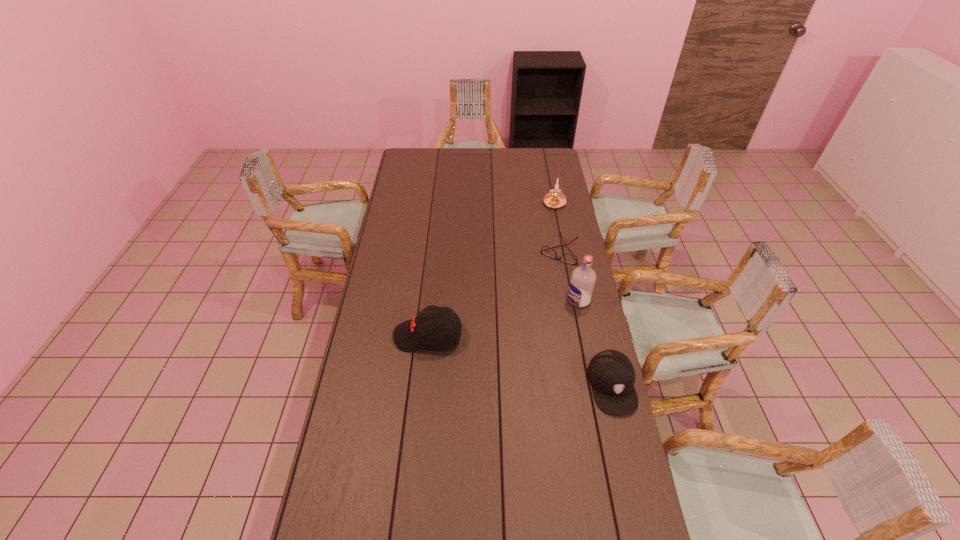
Identify the location of vacant spot on the desktop that is between the fourth farthest object and the cap and is positioned on the front-facing side of the spectacles. (497, 355).

This screenshot has width=960, height=540. In order to click on free space on the desktop that is between the fourth farthest object and the fourth tallest object and is positioned on the label of the vodka in this screenshot , I will do `click(492, 353)`.

Find the location of `vacant space on the desktop that is between the baseball cap and the fourth tallest object and is positioned on the handle side of the farthest object`. vacant space on the desktop that is between the baseball cap and the fourth tallest object and is positioned on the handle side of the farthest object is located at coordinates (493, 354).